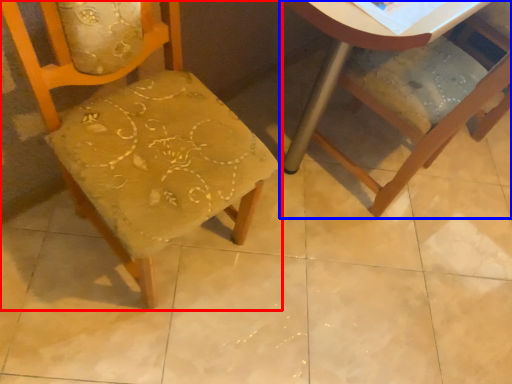
Question: Which of the following is the closest to the observer, chair (highlighted by a red box) or chair (highlighted by a blue box)?

Choices:
 (A) chair
 (B) chair

Answer: (A)